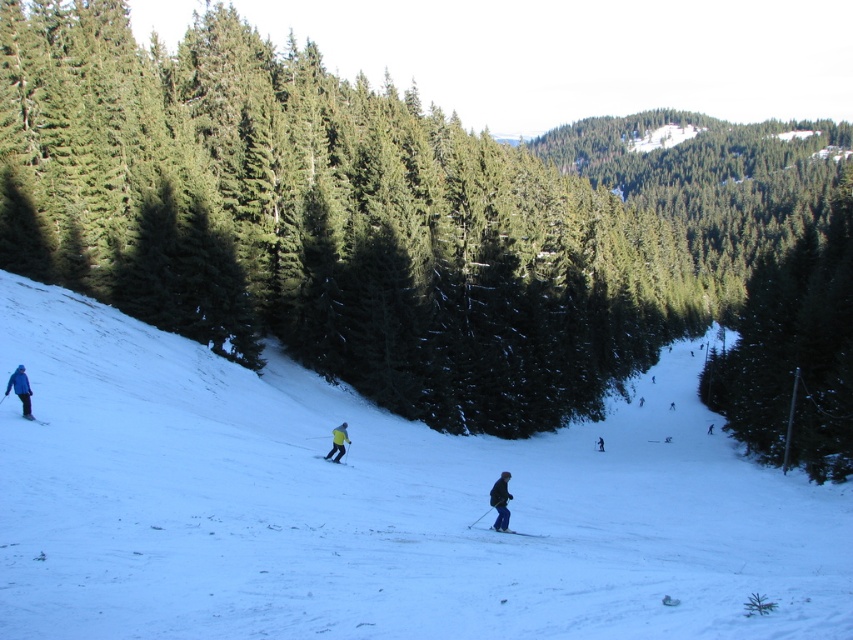
Who is more forward, [741,392] or [503,532]?

Point [503,532] is in front.

Is green matte tree at right below matte blue ski at center?

No, green matte tree at right is not below matte blue ski at center.

Where is `green matte tree at right`? This screenshot has width=853, height=640. green matte tree at right is located at coordinates point(793,353).

Based on the photo, can you confirm if green textured pine trees at center is bigger than matte blue ski at center?

Indeed, green textured pine trees at center has a larger size compared to matte blue ski at center.

Is green textured pine trees at center below matte blue ski at center?

Actually, green textured pine trees at center is above matte blue ski at center.

Locate an element on the screen. green textured pine trees at center is located at coordinates (323, 221).

Does green matte tree at right appear under yellow fabric ski at center?

No.

Which is more to the left, green matte tree at right or yellow fabric ski at center?

yellow fabric ski at center is more to the left.

Is point (782, 456) closer to camera compared to point (328, 458)?

No.

Where is `green matte tree at right`? The height and width of the screenshot is (640, 853). green matte tree at right is located at coordinates (793, 353).